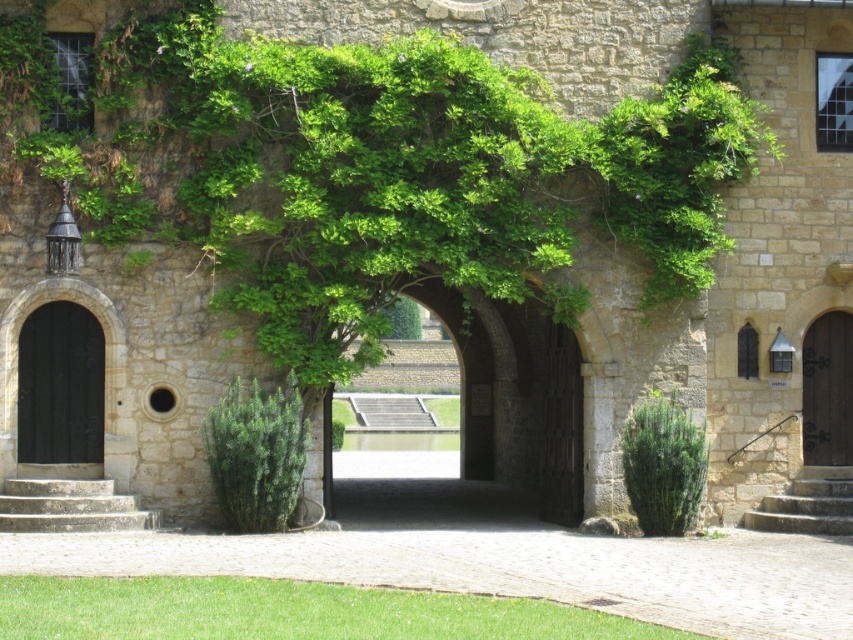
Question: Does green leafy plant at lower center appear under stone stairs at lower right?

Choices:
 (A) no
 (B) yes

Answer: (B)

Question: Can you confirm if green leafy plant at lower center is positioned above stone stairs at lower right?

Choices:
 (A) no
 (B) yes

Answer: (A)

Question: Is green leafy plant at lower center behind green leafy bush at center?

Choices:
 (A) yes
 (B) no

Answer: (B)

Question: Which point is farther to the camera?

Choices:
 (A) green leafy plant at lower center
 (B) green leafy bush at center

Answer: (B)

Question: Which point is farther from the camera taking this photo?

Choices:
 (A) (47, 486)
 (B) (834, 486)
 (C) (653, 461)
 (D) (61, 618)

Answer: (B)

Question: Which of the following is the closest to the observer?

Choices:
 (A) (84, 416)
 (B) (809, 365)
 (C) (666, 461)
 (D) (53, 525)

Answer: (D)